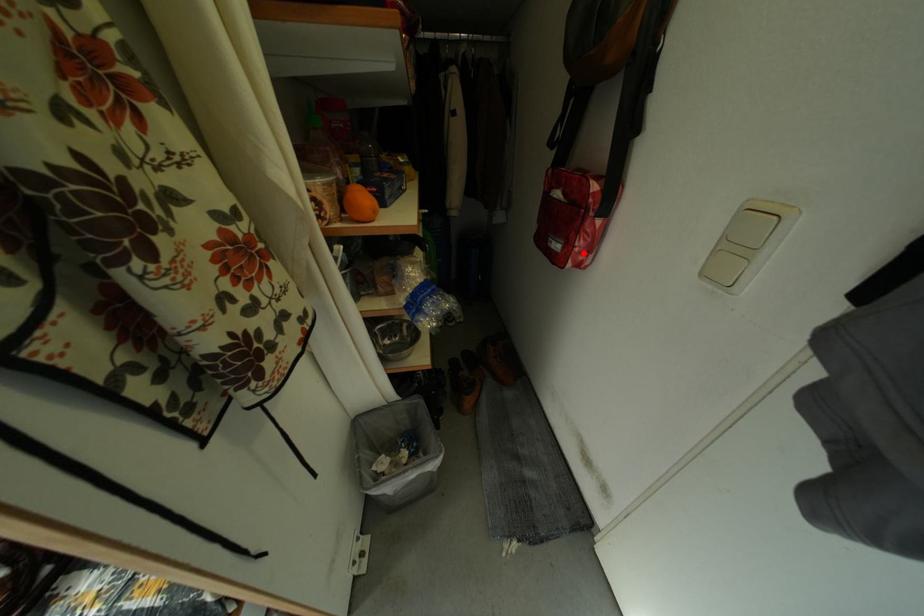
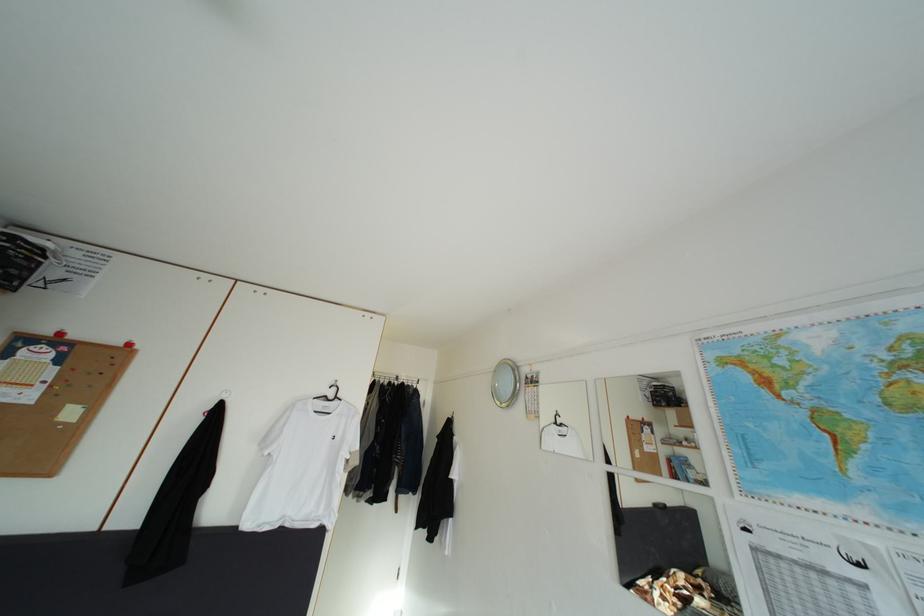
Question: I am providing you with two images of the same scene from different viewpoints. A red point is marked on the first image. Is the red point's position out of view in image 2?

Choices:
 (A) Yes
 (B) No

Answer: (A)